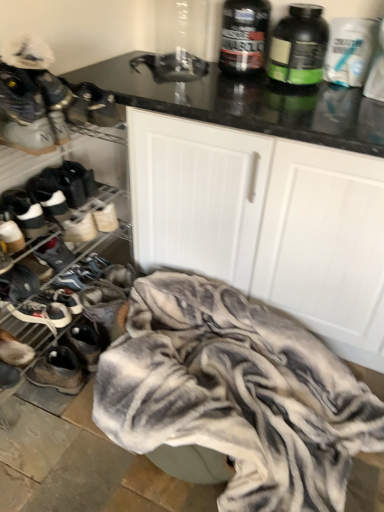
Question: Looking at their shapes, would you say white suede sneakers at left, which is the 8th footwear from bottom to top, is wider or thinner than dark gray suede sneaker at lower left, acting as the eighth footwear starting from the top?

Choices:
 (A) thin
 (B) wide

Answer: (B)

Question: Choose the correct answer: Is white suede sneakers at left, the second footwear when ordered from top to bottom, inside dark gray suede sneaker at lower left, placed as the 2th footwear when sorted from bottom to top, or outside it?

Choices:
 (A) outside
 (B) inside

Answer: (A)

Question: Which object is the farthest from the leather sneaker at lower left, the ninth footwear from the top?

Choices:
 (A) white matte cabinet at center
 (B) white matte protein powder bottle at upper right, positioned as the 1th bottle in right-to-left order
 (C) white leather sneakers at left, placed as the fourth footwear when sorted from bottom to top
 (D) matte black sneaker at left, marked as the fifth footwear in a bottom-to-top arrangement
 (E) white suede sneakers at left, the 6th footwear in the bottom-to-top sequence

Answer: (B)

Question: Estimate the real-world distances between objects in this image. Which object is farther from the white suede sneaker at left, acting as the 7th footwear starting from the bottom?

Choices:
 (A) dark gray suede sneaker at lower left, acting as the eighth footwear starting from the top
 (B) white matte protein powder bottle at upper right, which appears as the 3th bottle when viewed from the left
 (C) white suede sneakers at left, the 6th footwear in the bottom-to-top sequence
 (D) white suede sneakers at left, which is the 8th footwear from bottom to top
 (E) white leather sneakers at left, placed as the fourth footwear when sorted from bottom to top

Answer: (B)